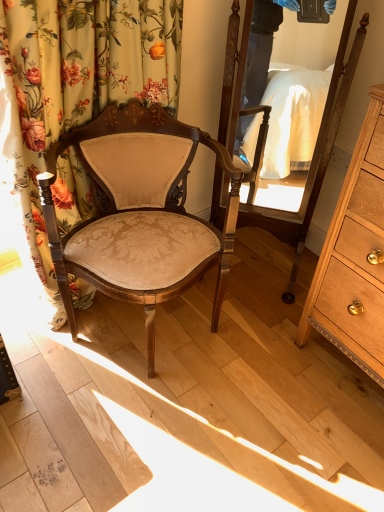
This screenshot has height=512, width=384. In order to click on unoccupied region to the right of matte beige fabric chair at center in this screenshot , I will do `click(274, 352)`.